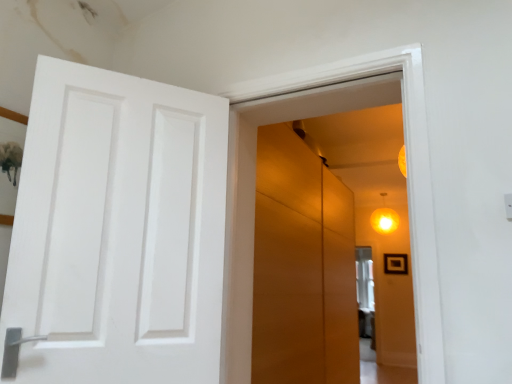
Question: Would you say black matte picture frame at upper right is a long distance from matte yellow globe light at upper right?

Choices:
 (A) no
 (B) yes

Answer: (A)

Question: Is black matte picture frame at upper right looking in the opposite direction of matte yellow globe light at upper right?

Choices:
 (A) yes
 (B) no

Answer: (B)

Question: From the image's perspective, is black matte picture frame at upper right below matte yellow globe light at upper right?

Choices:
 (A) yes
 (B) no

Answer: (A)

Question: Can you confirm if black matte picture frame at upper right is thinner than matte yellow globe light at upper right?

Choices:
 (A) no
 (B) yes

Answer: (B)

Question: From a real-world perspective, is black matte picture frame at upper right beneath matte yellow globe light at upper right?

Choices:
 (A) yes
 (B) no

Answer: (A)

Question: In the image, is black matte picture frame at upper right positioned in front of or behind matte orange cabinet at center?

Choices:
 (A) front
 (B) behind

Answer: (B)

Question: Is black matte picture frame at upper right to the left or to the right of matte orange cabinet at center in the image?

Choices:
 (A) left
 (B) right

Answer: (B)

Question: From a real-world perspective, is black matte picture frame at upper right above or below matte orange cabinet at center?

Choices:
 (A) above
 (B) below

Answer: (A)

Question: Considering the positions of black matte picture frame at upper right and matte orange cabinet at center in the image, is black matte picture frame at upper right taller or shorter than matte orange cabinet at center?

Choices:
 (A) tall
 (B) short

Answer: (B)

Question: Is point (346, 201) closer or farther from the camera than point (402, 261)?

Choices:
 (A) farther
 (B) closer

Answer: (B)

Question: Is matte orange cabinet at center situated inside black matte picture frame at upper right or outside?

Choices:
 (A) inside
 (B) outside

Answer: (B)

Question: Considering the relative positions of matte orange cabinet at center and black matte picture frame at upper right in the image provided, is matte orange cabinet at center to the left or to the right of black matte picture frame at upper right?

Choices:
 (A) left
 (B) right

Answer: (A)

Question: Is matte orange cabinet at center bigger or smaller than black matte picture frame at upper right?

Choices:
 (A) big
 (B) small

Answer: (A)

Question: From a real-world perspective, is matte yellow globe light at upper right positioned above or below matte orange cabinet at center?

Choices:
 (A) above
 (B) below

Answer: (A)

Question: Is matte yellow globe light at upper right bigger or smaller than matte orange cabinet at center?

Choices:
 (A) small
 (B) big

Answer: (A)